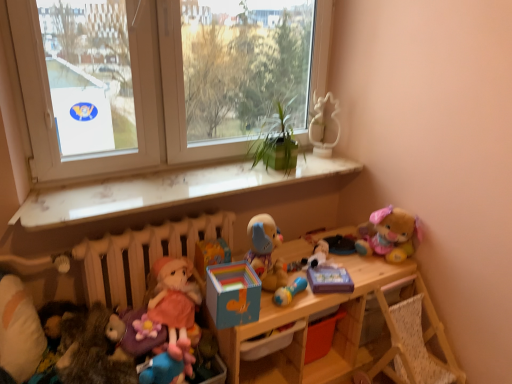
Where is `vacant space in front of white paper at upper left, positioned as the 2th window screen in right-to-left order`? Image resolution: width=512 pixels, height=384 pixels. vacant space in front of white paper at upper left, positioned as the 2th window screen in right-to-left order is located at coordinates (82, 202).